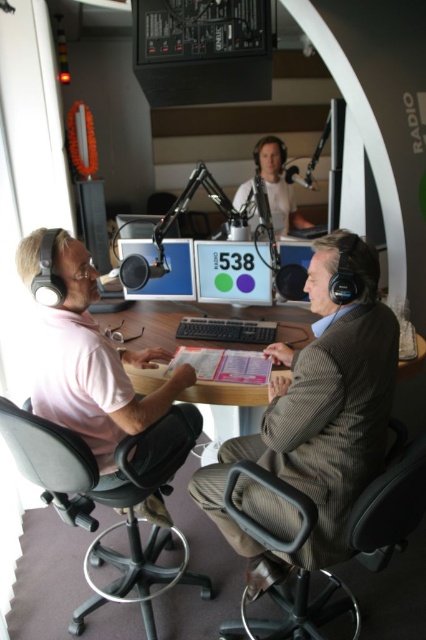
Question: Can you confirm if black leather swivel chair at lower center is positioned above matte black monitor at center?

Choices:
 (A) yes
 (B) no

Answer: (B)

Question: Which point is closer to the camera?

Choices:
 (A) matte black monitor at upper center
 (B) matte plastic computer screen at center
 (C) striped fabric suit at center

Answer: (C)

Question: Is matte plastic computer screen at center wider than matte black monitor at center?

Choices:
 (A) yes
 (B) no

Answer: (A)

Question: Can you confirm if matte pink shirt at left is positioned above matte black monitor at center?

Choices:
 (A) yes
 (B) no

Answer: (B)

Question: Which point is farther to the camera?

Choices:
 (A) matte pink shirt at left
 (B) matte plastic computer screen at center
 (C) black leather swivel chair at lower center
 (D) striped fabric suit at center

Answer: (B)

Question: Which is farther from the matte black monitor at upper center?

Choices:
 (A) black leather swivel chair at center
 (B) matte black monitor at center

Answer: (A)